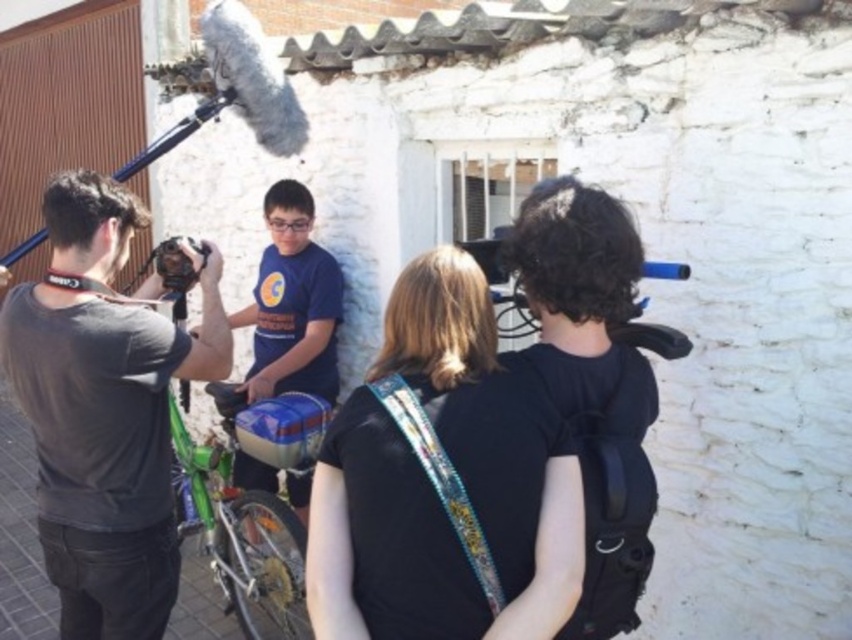
From the picture: You are a photographer trying to set up your equipment. You have a green matte bicycle at center and a matte black tripod at upper left. The minimum distance required between the tripod and the bicycle for proper setup is 1.6 meters. Can you set up your equipment as planned?

The green matte bicycle at center and the matte black tripod at upper left are 1.55 meters apart, which is less than the required 1.6 meters. Therefore, you cannot set up your equipment as planned.